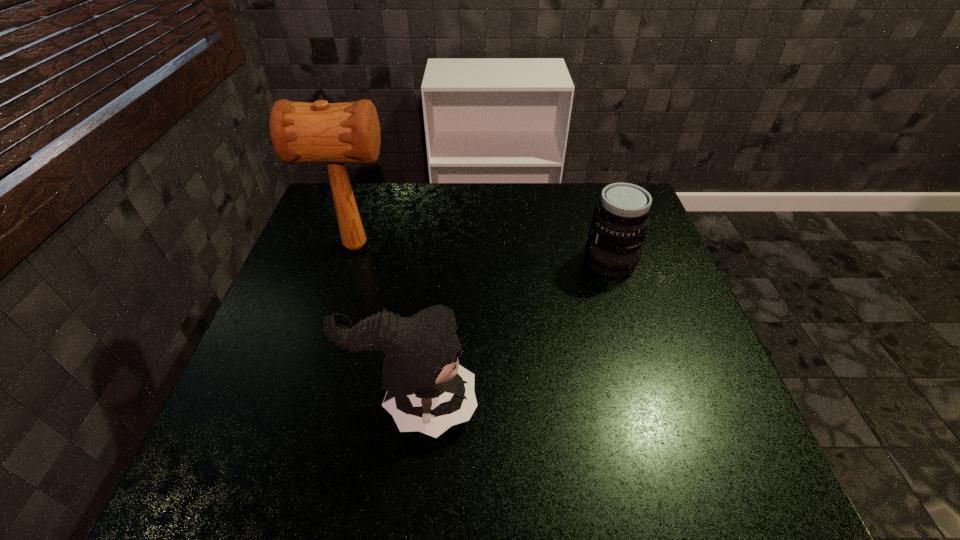
This screenshot has width=960, height=540. Identify the location of unoccupied area between the rightmost object and the doll. (513, 333).

This screenshot has width=960, height=540. I want to click on empty space that is in between the telephoto lens and the tallest object, so click(x=483, y=254).

Identify which object is the second nearest to the second shortest object. Please provide its 2D coordinates. Your answer should be formatted as a tuple, i.e. [(x, y)], where the tuple contains the x and y coordinates of a point satisfying the conditions above.

[(620, 221)]

In order to click on the second closest object to the rightmost object in this screenshot , I will do (336, 133).

Image resolution: width=960 pixels, height=540 pixels. What are the coordinates of `vacant space that satisfies the following two spatial constraints: 1. on the strike surface of the mallet; 2. on the right side of the shortest object` in the screenshot? It's located at (351, 262).

Identify the location of free point that satisfies the following two spatial constraints: 1. on the strike surface of the tallest object; 2. on the left side of the telephoto lens. This screenshot has height=540, width=960. (351, 262).

Identify the location of free space that satisfies the following two spatial constraints: 1. on the back side of the telephoto lens; 2. on the strike surface of the mallet. This screenshot has height=540, width=960. (605, 246).

At what (x,y) coordinates should I click in order to perform the action: click on vacant point that satisfies the following two spatial constraints: 1. on the strike surface of the tallest object; 2. on the left side of the rightmost object. Please return your answer as a coordinate pair (x, y). Looking at the image, I should click on (351, 262).

Find the location of `free spot that satisfies the following two spatial constraints: 1. on the front side of the rightmost object; 2. at the face of the second shortest object`. free spot that satisfies the following two spatial constraints: 1. on the front side of the rightmost object; 2. at the face of the second shortest object is located at coordinates (655, 404).